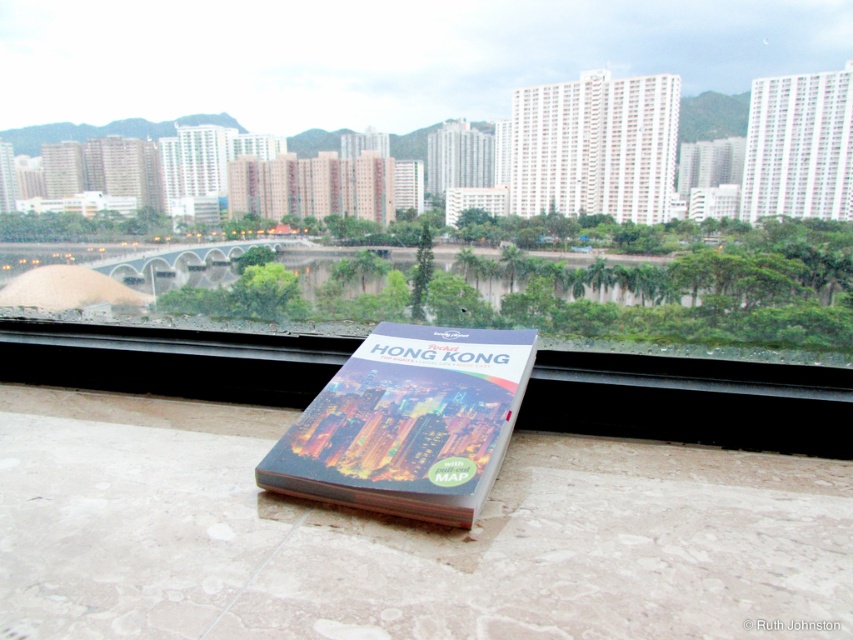
Question: Which object is farther from the camera taking this photo?

Choices:
 (A) white tile at lower center
 (B) matte plastic hong kong guidebook at center

Answer: (A)

Question: Can you confirm if white tile at lower center is positioned to the left of matte plastic hong kong guidebook at center?

Choices:
 (A) no
 (B) yes

Answer: (B)

Question: Does white tile at lower center appear on the right side of matte plastic hong kong guidebook at center?

Choices:
 (A) no
 (B) yes

Answer: (A)

Question: Considering the relative positions of white tile at lower center and matte plastic hong kong guidebook at center in the image provided, where is white tile at lower center located with respect to matte plastic hong kong guidebook at center?

Choices:
 (A) below
 (B) above

Answer: (B)